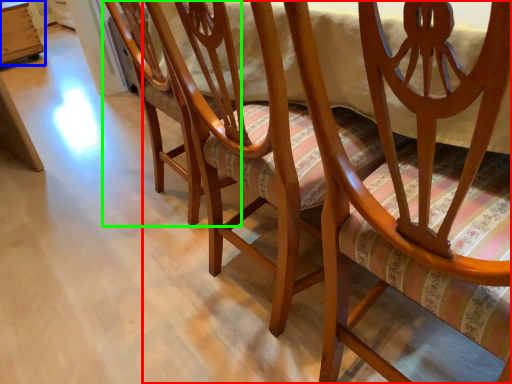
Question: Which object is the farthest from chair (highlighted by a red box)? Choose among these: table (highlighted by a blue box) or chair (highlighted by a green box).

Choices:
 (A) table
 (B) chair

Answer: (A)